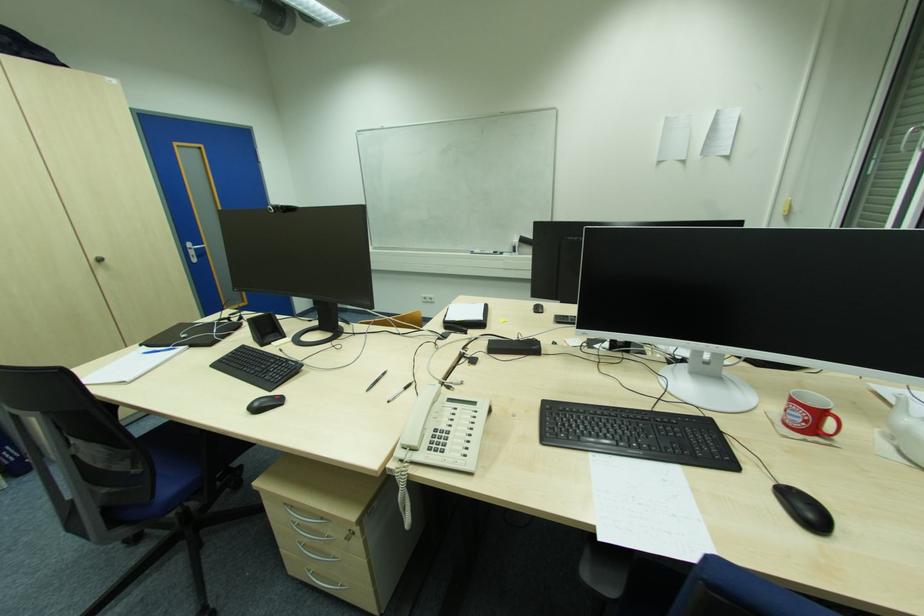
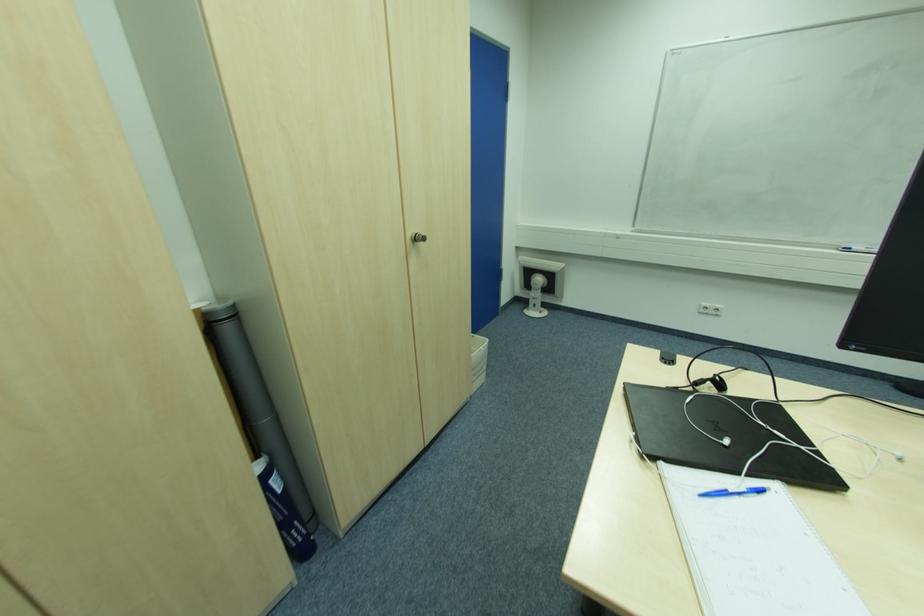
Locate, in the second image, the point that corresponds to [161,353] in the first image.

(727, 493)